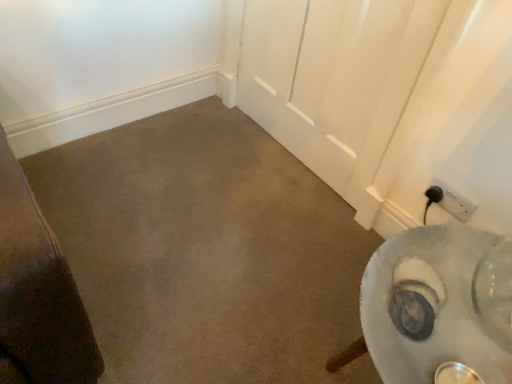
Question: Can you confirm if black plastic power plug at lower right is positioned to the right of brown matte concrete at center?

Choices:
 (A) yes
 (B) no

Answer: (A)

Question: Is black plastic power plug at lower right facing towards brown matte concrete at center?

Choices:
 (A) no
 (B) yes

Answer: (A)

Question: Is black plastic power plug at lower right surrounding brown matte concrete at center?

Choices:
 (A) no
 (B) yes

Answer: (A)

Question: From the image's perspective, is black plastic power plug at lower right below brown matte concrete at center?

Choices:
 (A) yes
 (B) no

Answer: (B)

Question: From a real-world perspective, is black plastic power plug at lower right below brown matte concrete at center?

Choices:
 (A) no
 (B) yes

Answer: (A)

Question: Is black plastic power plug at lower right oriented away from brown matte concrete at center?

Choices:
 (A) no
 (B) yes

Answer: (A)

Question: Can you confirm if brown matte concrete at center is bigger than black plastic power plug at lower right?

Choices:
 (A) yes
 (B) no

Answer: (A)

Question: Would you say brown matte concrete at center is outside black plastic power plug at lower right?

Choices:
 (A) yes
 (B) no

Answer: (A)

Question: Is brown matte concrete at center taller than black plastic power plug at lower right?

Choices:
 (A) no
 (B) yes

Answer: (A)

Question: Are brown matte concrete at center and black plastic power plug at lower right far apart?

Choices:
 (A) yes
 (B) no

Answer: (B)

Question: Is brown matte concrete at center looking in the opposite direction of black plastic power plug at lower right?

Choices:
 (A) yes
 (B) no

Answer: (B)

Question: Considering the relative sizes of brown matte concrete at center and black plastic power plug at lower right in the image provided, is brown matte concrete at center thinner than black plastic power plug at lower right?

Choices:
 (A) no
 (B) yes

Answer: (A)

Question: From the image's perspective, is black plastic power plug at lower right above or below brown matte concrete at center?

Choices:
 (A) below
 (B) above

Answer: (B)